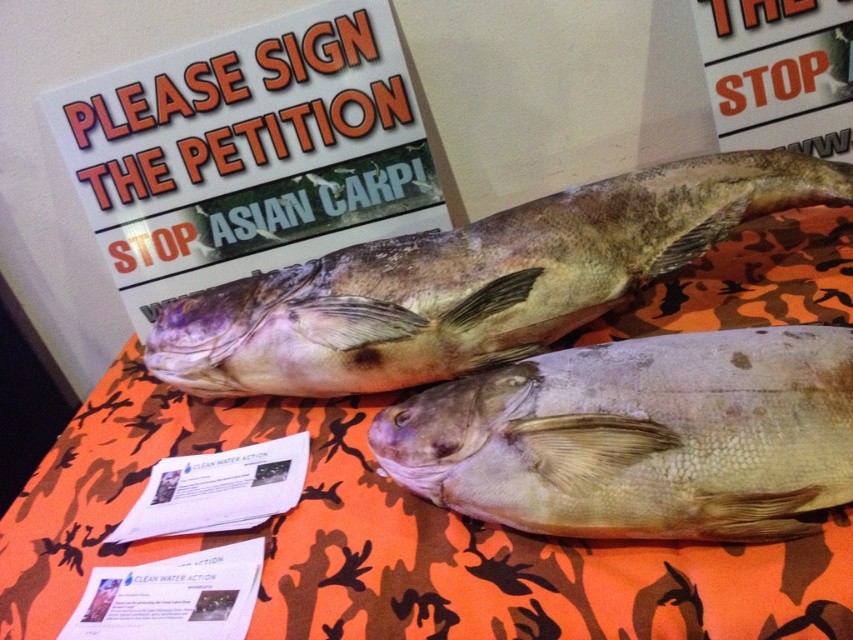
Does orange camo table at center lie in front of white paper at upper right?

Yes.

This screenshot has width=853, height=640. What do you see at coordinates (387, 540) in the screenshot?
I see `orange camo table at center` at bounding box center [387, 540].

The height and width of the screenshot is (640, 853). Identify the location of orange camo table at center. (387, 540).

Between point (718, 484) and point (598, 212), which one is positioned in front?

Point (718, 484) is in front.

This screenshot has width=853, height=640. What do you see at coordinates (639, 436) in the screenshot?
I see `grayish matte fish at center` at bounding box center [639, 436].

Image resolution: width=853 pixels, height=640 pixels. I want to click on grayish matte fish at center, so click(x=639, y=436).

Between white paper sign at upper left and speckled skin fish at center, which one is positioned lower?

speckled skin fish at center is below.

Between white paper sign at upper left and speckled skin fish at center, which one appears on the right side from the viewer's perspective?

Positioned to the right is speckled skin fish at center.

Describe the element at coordinates (248, 152) in the screenshot. This screenshot has height=640, width=853. I see `white paper sign at upper left` at that location.

The height and width of the screenshot is (640, 853). I want to click on white paper sign at upper left, so click(248, 152).